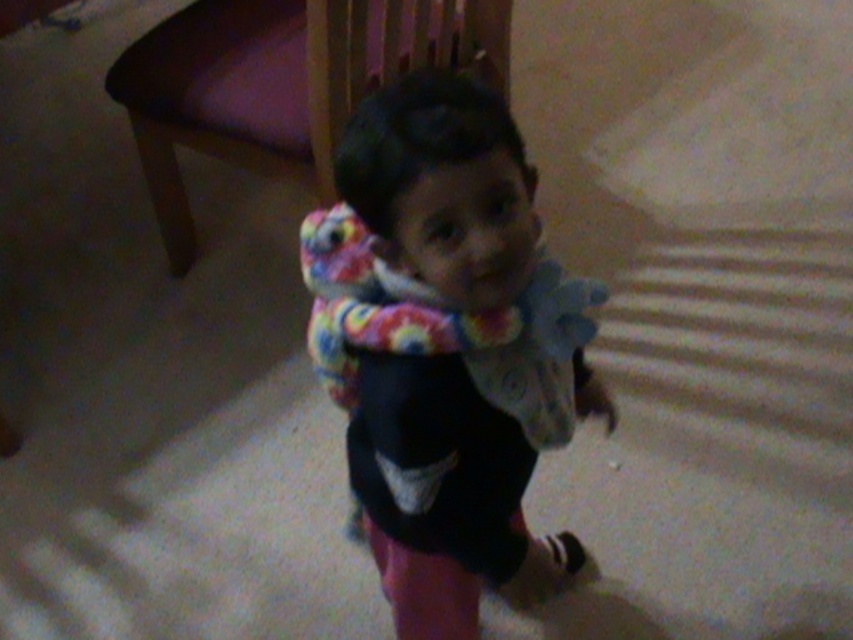
Image resolution: width=853 pixels, height=640 pixels. What do you see at coordinates (274, 84) in the screenshot?
I see `wooden chair at upper left` at bounding box center [274, 84].

Can you confirm if wooden chair at upper left is thinner than fluffy multicolored scarf at center?

Incorrect, wooden chair at upper left's width is not less than fluffy multicolored scarf at center's.

Who is more distant from viewer, (x=264, y=120) or (x=479, y=330)?

Point (x=264, y=120)

Find the location of a particular element. Image resolution: width=853 pixels, height=640 pixels. wooden chair at upper left is located at coordinates (274, 84).

Between soft fleece sweater at center and wooden chair at upper left, which one has more height?

soft fleece sweater at center

I want to click on soft fleece sweater at center, so click(x=445, y=348).

Measure the distance between point (511, 531) and camera.

They are 1.11 meters apart.

I want to click on soft fleece sweater at center, so click(x=445, y=348).

Is soft fleece sweater at center to the left of fluffy multicolored scarf at center from the viewer's perspective?

No, soft fleece sweater at center is not to the left of fluffy multicolored scarf at center.

Is soft fleece sweater at center further to the viewer compared to fluffy multicolored scarf at center?

That is False.

Is point (463, 522) positioned in front of point (416, 307)?

No, (463, 522) is behind (416, 307).

At what (x,y) coordinates should I click in order to perform the action: click on soft fleece sweater at center. Please return your answer as a coordinate pair (x, y). Image resolution: width=853 pixels, height=640 pixels. Looking at the image, I should click on (445, 348).